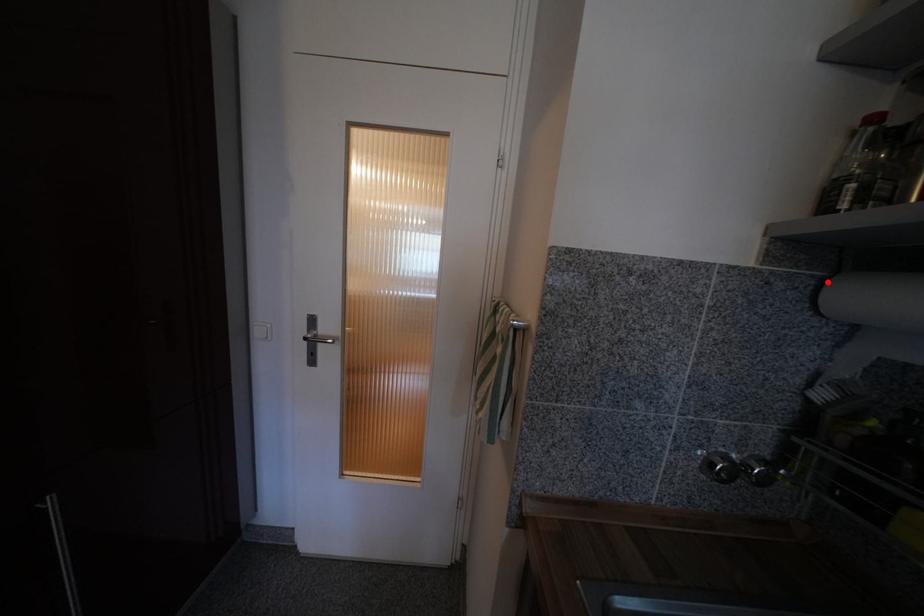
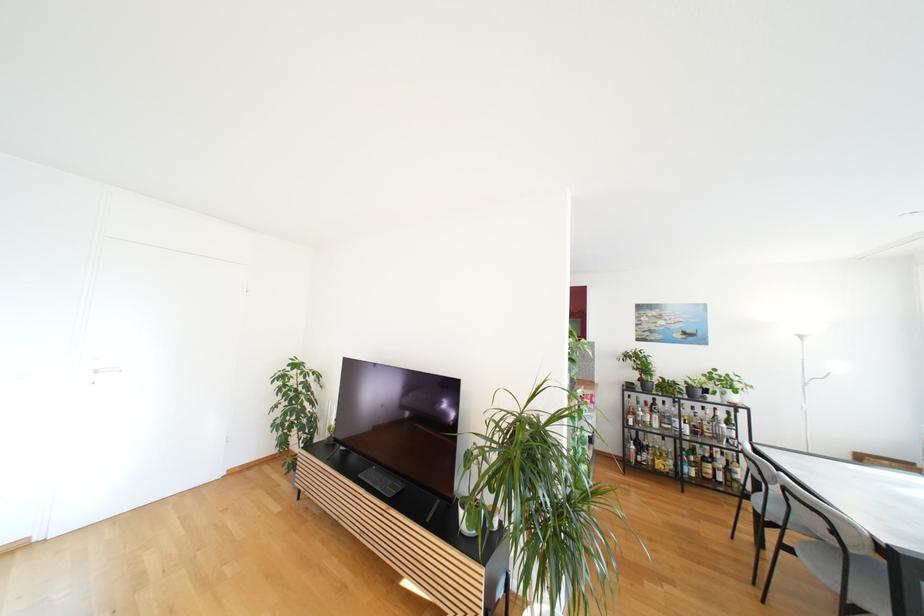
Question: I am providing you with two images of the same scene from different viewpoints. A red point is marked on the first image. Is the red point's position out of view in image 2?

Choices:
 (A) Yes
 (B) No

Answer: (A)